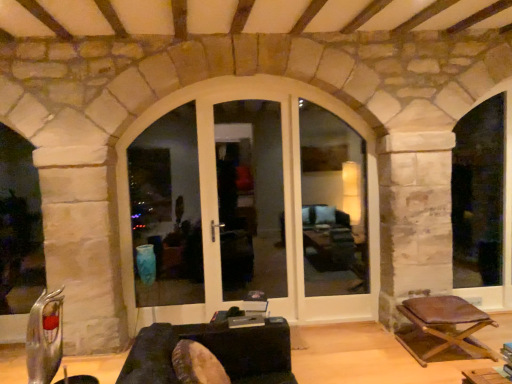
Question: Does white glossy door at center lie in front of white glossy door at center, acting as the 1th window frame starting from the left?

Choices:
 (A) no
 (B) yes

Answer: (A)

Question: Is white glossy door at center not inside white glossy door at center, the 3th window frame viewed from the right?

Choices:
 (A) no
 (B) yes

Answer: (B)

Question: From a real-world perspective, is white glossy door at center positioned over white glossy door at center, acting as the 1th window frame starting from the left, based on gravity?

Choices:
 (A) yes
 (B) no

Answer: (B)

Question: Is white glossy door at center surrounding white glossy door at center, acting as the 1th window frame starting from the left?

Choices:
 (A) yes
 (B) no

Answer: (B)

Question: Is white glossy door at center wider than white glossy door at center, acting as the 1th window frame starting from the left?

Choices:
 (A) no
 (B) yes

Answer: (A)

Question: Is white glossy door at center shorter than white glossy door at center, acting as the 1th window frame starting from the left?

Choices:
 (A) no
 (B) yes

Answer: (A)

Question: Can you confirm if white glossy door at center, the 3th window frame viewed from the right, is positioned to the left of dark brown leather couch at center?

Choices:
 (A) no
 (B) yes

Answer: (B)

Question: Considering the relative sizes of white glossy door at center, the 3th window frame viewed from the right, and dark brown leather couch at center in the image provided, is white glossy door at center, the 3th window frame viewed from the right, taller than dark brown leather couch at center?

Choices:
 (A) no
 (B) yes

Answer: (B)

Question: Can you confirm if white glossy door at center, acting as the 1th window frame starting from the left, is smaller than dark brown leather couch at center?

Choices:
 (A) yes
 (B) no

Answer: (A)

Question: From a real-world perspective, is white glossy door at center, the 3th window frame viewed from the right, located higher than dark brown leather couch at center?

Choices:
 (A) no
 (B) yes

Answer: (B)

Question: Can you confirm if white glossy door at center, the 3th window frame viewed from the right, is bigger than dark brown leather couch at center?

Choices:
 (A) yes
 (B) no

Answer: (B)

Question: Does white glossy door at center, the 3th window frame viewed from the right, have a lesser height compared to dark brown leather couch at center?

Choices:
 (A) no
 (B) yes

Answer: (A)

Question: Is white glossy door at center, the 3th window frame viewed from the right, facing away from white wood window frame at right, positioned as the 1th window frame in right-to-left order?

Choices:
 (A) yes
 (B) no

Answer: (B)